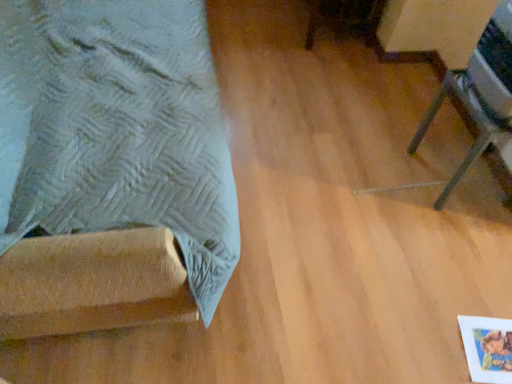
At what (x,y) coordinates should I click in order to perform the action: click on space that is in front of metallic silver tripod at right, the second furniture positioned from the left. Please return your answer as a coordinate pair (x, y). The height and width of the screenshot is (384, 512). Looking at the image, I should click on (458, 235).